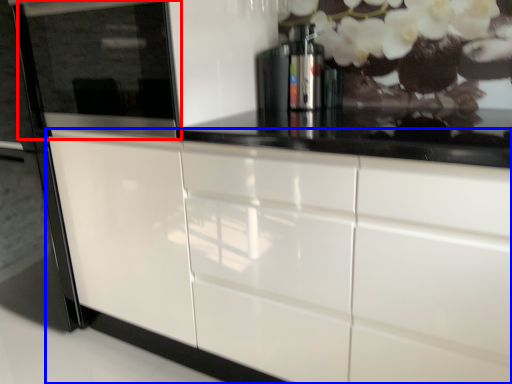
Question: Which of the following is the farthest to the observer, appliance (highlighted by a red box) or cabinetry (highlighted by a blue box)?

Choices:
 (A) appliance
 (B) cabinetry

Answer: (A)